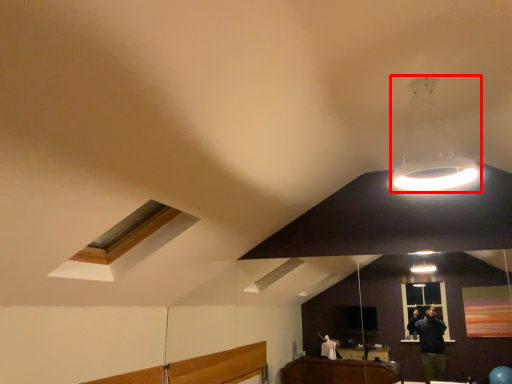
Question: From the image's perspective, what is the correct spatial relationship of lamp (annotated by the red box) in relation to window?

Choices:
 (A) above
 (B) below

Answer: (A)